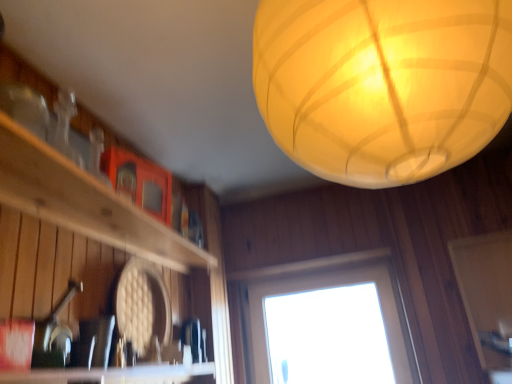
This screenshot has width=512, height=384. What do you see at coordinates (326, 323) in the screenshot? I see `transparent glass window at center` at bounding box center [326, 323].

This screenshot has height=384, width=512. In order to click on white matte screen door at lower right in this screenshot , I will do `click(487, 298)`.

Locate an element on the screen. The width and height of the screenshot is (512, 384). transparent glass window at center is located at coordinates (326, 323).

Is white matte screen door at lower right at the back of translucent paper lantern at upper center?

Yes.

Is translucent paper lantern at upper center inside or outside of white matte screen door at lower right?

translucent paper lantern at upper center is outside white matte screen door at lower right.

From the image's perspective, is translucent paper lantern at upper center above white matte screen door at lower right?

Indeed, from the image's perspective, translucent paper lantern at upper center is shown above white matte screen door at lower right.

Can you confirm if wooden shelf at left is positioned to the left of translucent paper lantern at upper center?

Yes, wooden shelf at left is to the left of translucent paper lantern at upper center.

Locate an element on the screen. shelf below the translucent paper lantern at upper center (from the image's perspective) is located at coordinates 84,202.

How many degrees apart are the facing directions of wooden shelf at left and translucent paper lantern at upper center?

wooden shelf at left and translucent paper lantern at upper center are facing 94.2 degrees away from each other.

From the image's perspective, is wooden shelf at left located beneath translucent paper lantern at upper center?

Yes, from the image's perspective, wooden shelf at left is below translucent paper lantern at upper center.

Which object is closer to the camera, translucent paper lantern at upper center or transparent glass window at center?

Positioned in front is translucent paper lantern at upper center.

Are translucent paper lantern at upper center and transparent glass window at center beside each other?

No, translucent paper lantern at upper center is not with transparent glass window at center.

Considering the positions of points (473, 79) and (280, 370), is point (473, 79) closer to camera compared to point (280, 370)?

Yes, point (473, 79) is in front of point (280, 370).

Considering the points (511, 257) and (69, 161), which point is in front, point (511, 257) or point (69, 161)?

The point (69, 161) is in front.

From the picture: Is white matte screen door at lower right looking in the opposite direction of wooden shelf at left?

No, wooden shelf at left is not at the back of white matte screen door at lower right.

Is white matte screen door at lower right far away from wooden shelf at left?

Absolutely, white matte screen door at lower right is distant from wooden shelf at left.

What's the angular difference between wooden shelf at left and transparent glass window at center's facing directions?

There is a 93.6-degree angle between the facing directions of wooden shelf at left and transparent glass window at center.

Considering the positions of points (62, 180) and (314, 379), is point (62, 180) farther from camera compared to point (314, 379)?

No, (62, 180) is closer to viewer.

From the picture: Can you confirm if wooden shelf at left is positioned to the right of transparent glass window at center?

In fact, wooden shelf at left is to the left of transparent glass window at center.

Is wooden shelf at left smaller than transparent glass window at center?

Yes.

Locate an element on the screen. This screenshot has width=512, height=384. screen door above the transparent glass window at center (from a real-world perspective) is located at coordinates (487, 298).

Are white matte screen door at lower right and transparent glass window at center located far from each other?

No, there isn't a large distance between white matte screen door at lower right and transparent glass window at center.

Is white matte screen door at lower right situated inside transparent glass window at center or outside?

white matte screen door at lower right lies outside transparent glass window at center.

From a real-world perspective, which object rests below the other?

transparent glass window at center, from a real-world perspective.

Who is more distant, wooden shelf at left or white matte screen door at lower right?

white matte screen door at lower right is further away from the camera.

Could white matte screen door at lower right be considered to be inside wooden shelf at left?

No.

From the image's perspective, is wooden shelf at left located beneath white matte screen door at lower right?

No, from the image's perspective, wooden shelf at left is not below white matte screen door at lower right.

Is point (63, 171) closer or farther from the camera than point (500, 328)?

Point (63, 171) appears to be closer to the viewer than point (500, 328).

Locate an element on the screen. This screenshot has height=384, width=512. screen door behind the translucent paper lantern at upper center is located at coordinates (487, 298).

This screenshot has width=512, height=384. I want to click on shelf located below the translucent paper lantern at upper center (from the image's perspective), so click(x=84, y=202).

Estimate the real-world distances between objects in this image. Which object is closer to transparent glass window at center, translucent paper lantern at upper center or wooden shelf at left?

wooden shelf at left lies closer to transparent glass window at center than the other object.

When comparing their distances from transparent glass window at center, does wooden shelf at left or white matte screen door at lower right seem further?

Among the two, wooden shelf at left is located further to transparent glass window at center.

Based on their spatial positions, is wooden shelf at left or translucent paper lantern at upper center further from white matte screen door at lower right?

wooden shelf at left is further to white matte screen door at lower right.

Which object lies further to the anchor point transparent glass window at center, white matte screen door at lower right or translucent paper lantern at upper center?

translucent paper lantern at upper center is positioned further to the anchor transparent glass window at center.

Which object lies nearer to the anchor point wooden shelf at left, white matte screen door at lower right or translucent paper lantern at upper center?

Among the two, translucent paper lantern at upper center is located nearer to wooden shelf at left.

From the image, which object appears to be farther from wooden shelf at left, white matte screen door at lower right or transparent glass window at center?

The object further to wooden shelf at left is white matte screen door at lower right.

When comparing their distances from translucent paper lantern at upper center, does white matte screen door at lower right or wooden shelf at left seem further?

white matte screen door at lower right is further to translucent paper lantern at upper center.

Looking at the image, which one is located further to wooden shelf at left, translucent paper lantern at upper center or transparent glass window at center?

transparent glass window at center is further to wooden shelf at left.

Identify the location of shelf between translucent paper lantern at upper center and transparent glass window at center in the front-back direction. (84, 202).

Find the location of a particular element. The height and width of the screenshot is (384, 512). screen door located between translucent paper lantern at upper center and transparent glass window at center in the depth direction is located at coordinates (487, 298).

You are a GUI agent. You are given a task and a screenshot of the screen. Output one action in this format:
    pyautogui.click(x=<x>, y=<y>)
    Task: Click on the window between wooden shelf at left and white matte screen door at lower right from left to right
    The image size is (512, 384).
    Given the screenshot: What is the action you would take?
    pyautogui.click(x=326, y=323)

Locate an element on the screen. The height and width of the screenshot is (384, 512). lantern between wooden shelf at left and white matte screen door at lower right is located at coordinates (382, 84).